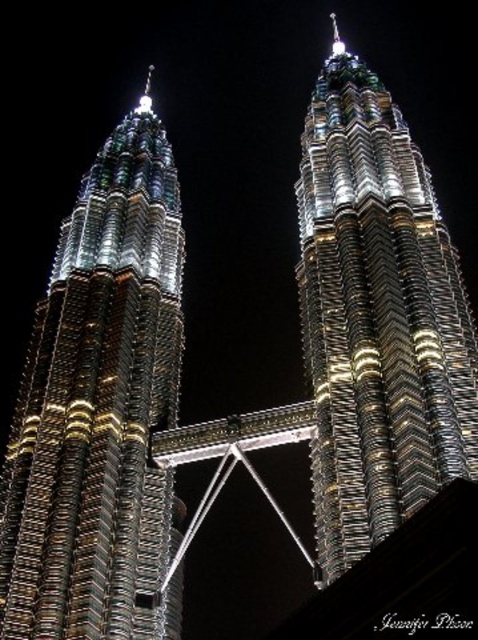
You are an architect analyzing the Petronas Twin Towers at night. You observe the metallic glass skyscraper at left and the metallic glass skyscraper at center. Which one has a greater height?

The metallic glass skyscraper at center is taller than the metallic glass skyscraper at left.

You are standing at the point with coordinates point (98, 404) in the image. What structure are you facing? Please answer with the object label from the scene.

The point (98, 404) corresponds to the metallic glass skyscraper at left.